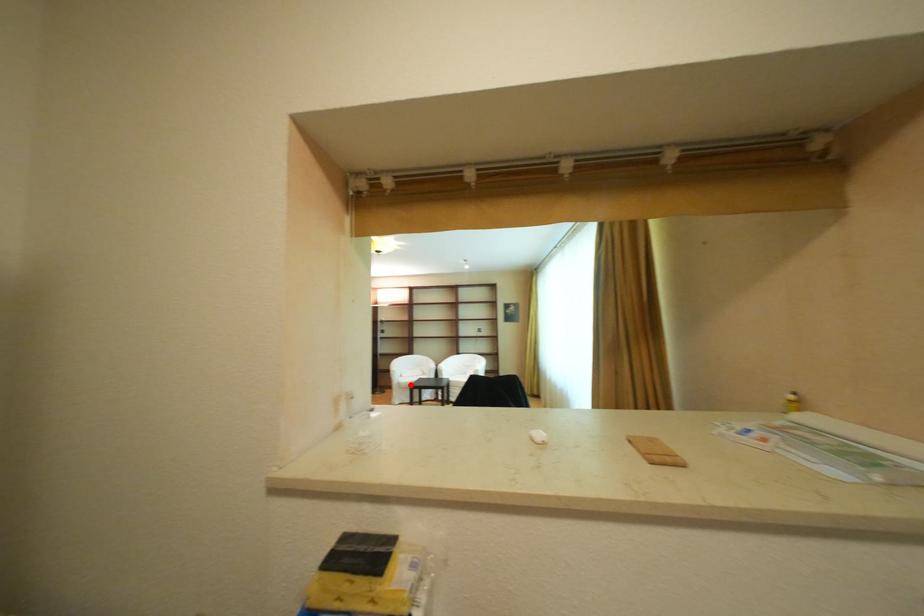
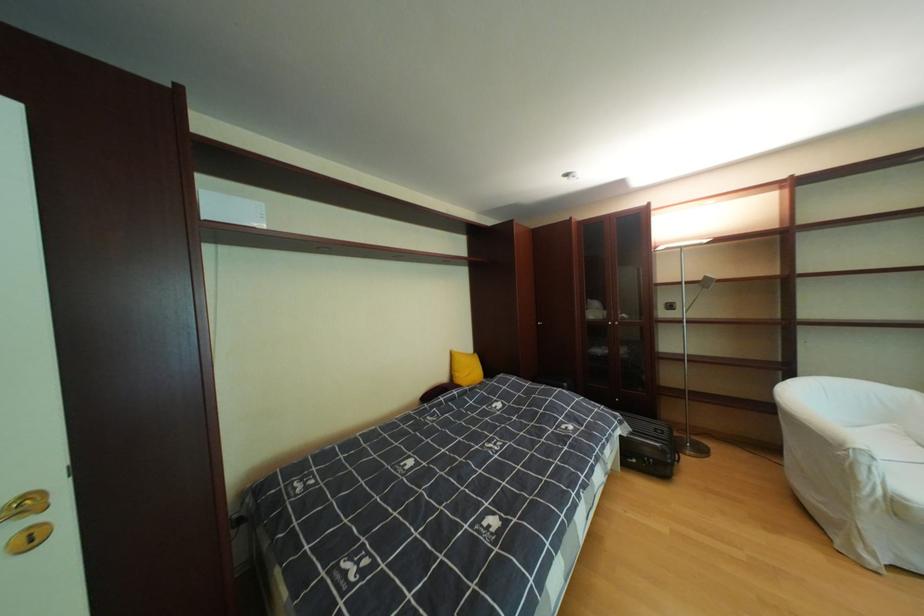
Question: I am providing you with two images of the same scene from different viewpoints. Given a red point in image1, look at the same physical point in image2. Is it:

Choices:
 (A) Closer to the viewpoint
 (B) Farther from the viewpoint

Answer: (A)